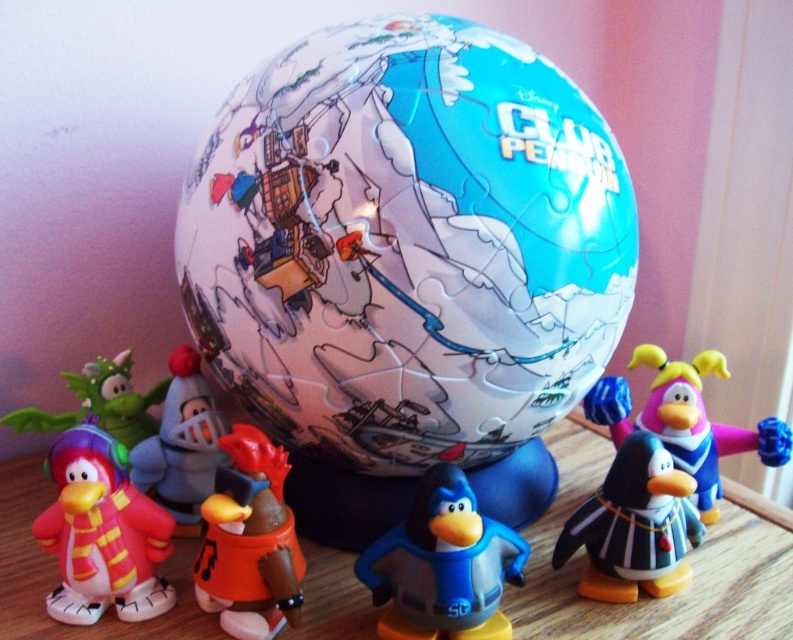
Question: Among these points, which one is farthest from the camera?

Choices:
 (A) (680, 497)
 (B) (262, 522)

Answer: (A)

Question: Which point is closer to the camera?

Choices:
 (A) matte green dragon at left
 (B) orange matte bucket at center

Answer: (B)

Question: Is wooden table at lower center below shiny blue plastic penguin at center right?

Choices:
 (A) no
 (B) yes

Answer: (B)

Question: Considering the real-world distances, which object is farthest from the matte plastic penguin at lower left?

Choices:
 (A) matte plastic globe at center
 (B) shiny blue plastic penguin at center right

Answer: (B)

Question: Can you confirm if matte plastic globe at center is positioned above blue plastic penguin at center?

Choices:
 (A) yes
 (B) no

Answer: (A)

Question: Is orange matte bucket at center thinner than shiny blue plastic penguin at center right?

Choices:
 (A) no
 (B) yes

Answer: (B)